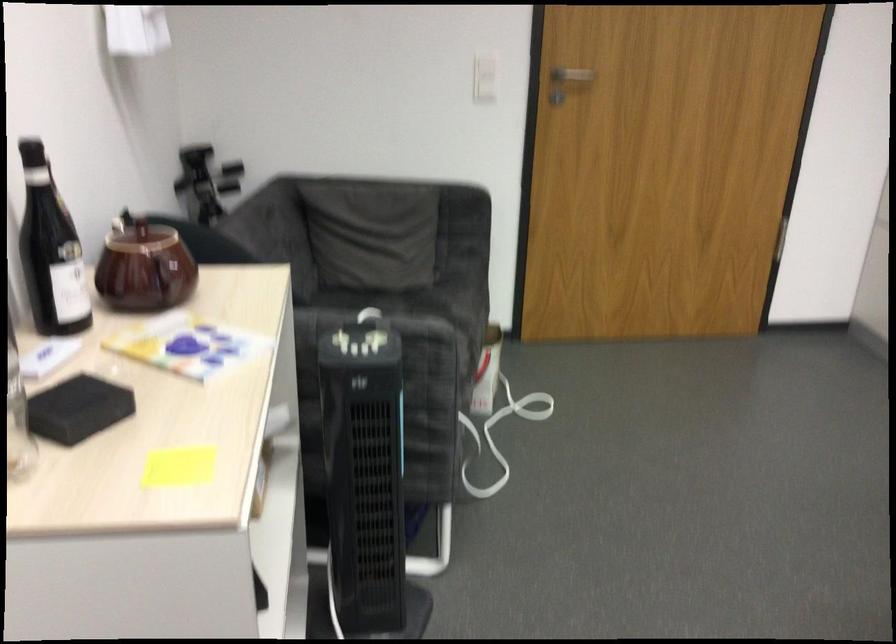
Identify the location of dark wine bottle. (49, 251).